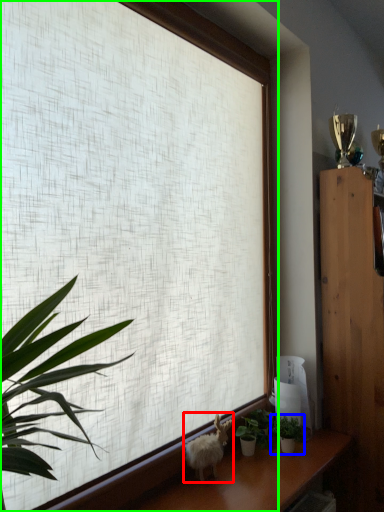
Question: Which object is the farthest from animal (highlighted by a red box)? Choose among these: houseplant (highlighted by a blue box) or window (highlighted by a green box).

Choices:
 (A) houseplant
 (B) window

Answer: (B)